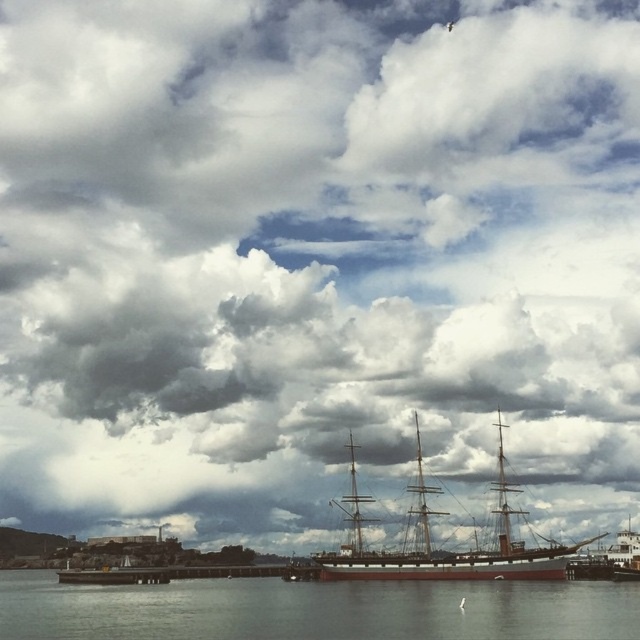
Can you confirm if clear water at lower center is smaller than wooden ship at center?

No.

In the scene shown: Is clear water at lower center above wooden ship at center?

No, clear water at lower center is not above wooden ship at center.

Between point (426, 588) and point (392, 572), which one is positioned behind?

The point (392, 572) is behind.

At what (x,y) coordinates should I click in order to perform the action: click on clear water at lower center. Please return your answer as a coordinate pair (x, y). This screenshot has height=640, width=640. Looking at the image, I should click on (314, 609).